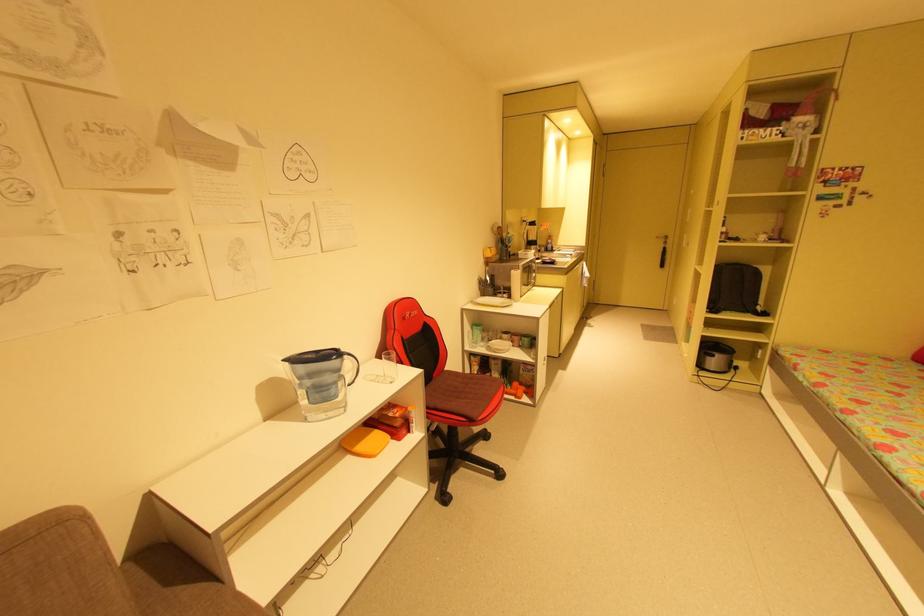
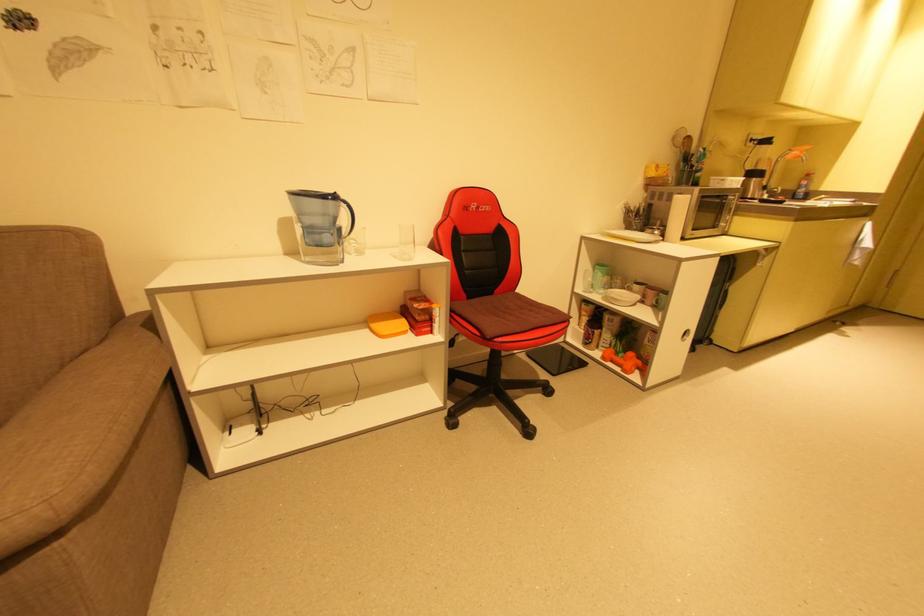
Locate, in the second image, the point that corresponds to [436,379] in the first image.

(495, 294)